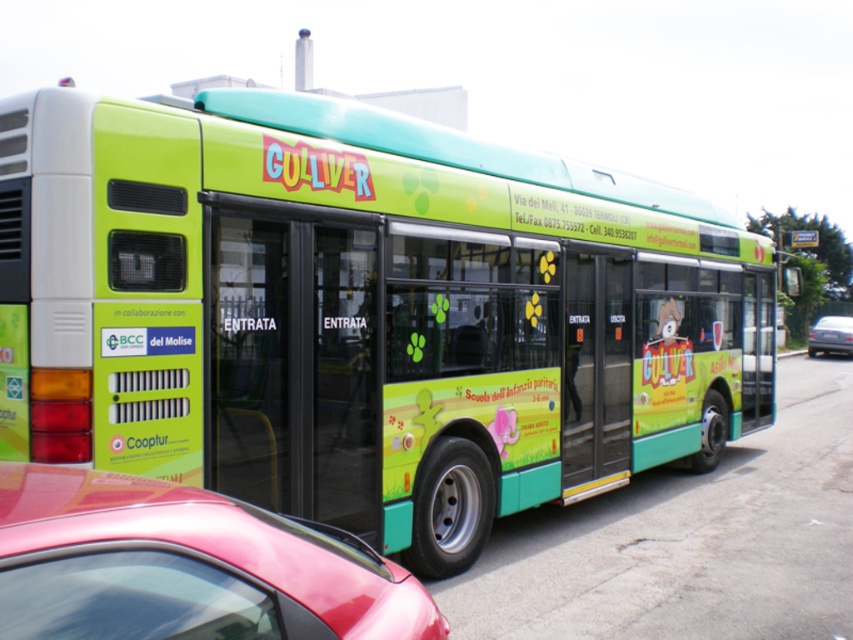
You are a delivery person who needs to place a new advertisement sticker on the green matte bus at center. The sticker requires a space that is 0.5 meters wide. Can you determine if there is enough space on the bus to accommodate the sticker based on its current position?

The green matte bus at center is positioned at coordinates point (361,314). However, the provided information does not specify the dimensions or available space on the bus, so it is impossible to determine if the 0.5 meters wide sticker can fit. Additional measurements of the bus are needed to make this assessment.

You are a delivery person who needs to place a box between the shiny red car at lower left and the camera. The box requires 1.6 meters of space. Can you fit the box in this space?

The space between the shiny red car at lower left and the camera is 1.58 meters, which is slightly less than the required 1.6 meters. Therefore, the box cannot be placed there.

You are a pedestrian standing on the sidewalk next to the road. You see the green matte bus at center and the shiny red car at lower left. Which vehicle is taller?

The shiny red car at lower left is taller than the green matte bus at center because the green matte bus at center is not as tall as shiny red car at lower left.